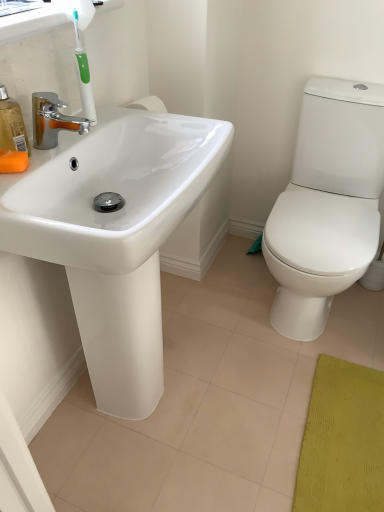
Question: Considering the relative sizes of white matte toilet paper at right and translucent orange soap dispenser at left in the image provided, is white matte toilet paper at right bigger than translucent orange soap dispenser at left?

Choices:
 (A) yes
 (B) no

Answer: (A)

Question: Can you confirm if white matte toilet paper at right is wider than translucent orange soap dispenser at left?

Choices:
 (A) no
 (B) yes

Answer: (B)

Question: Can you confirm if white matte toilet paper at right is thinner than translucent orange soap dispenser at left?

Choices:
 (A) no
 (B) yes

Answer: (A)

Question: Is translucent orange soap dispenser at left inside white matte toilet paper at right?

Choices:
 (A) no
 (B) yes

Answer: (A)

Question: Is white matte toilet paper at right placed right next to translucent orange soap dispenser at left?

Choices:
 (A) yes
 (B) no

Answer: (B)

Question: In the image, is white glossy sink at left on the left side or the right side of white matte toilet paper at right?

Choices:
 (A) right
 (B) left

Answer: (B)

Question: Would you say white glossy sink at left is inside or outside white matte toilet paper at right?

Choices:
 (A) inside
 (B) outside

Answer: (B)

Question: Is white glossy sink at left bigger or smaller than white matte toilet paper at right?

Choices:
 (A) small
 (B) big

Answer: (B)

Question: Considering the positions of white glossy sink at left and white matte toilet paper at right in the image, is white glossy sink at left wider or thinner than white matte toilet paper at right?

Choices:
 (A) wide
 (B) thin

Answer: (A)

Question: Does point (x=84, y=177) appear closer or farther from the camera than point (x=23, y=169)?

Choices:
 (A) farther
 (B) closer

Answer: (A)

Question: From a real-world perspective, is white glossy sink at left positioned above or below orange matte soap at left?

Choices:
 (A) above
 (B) below

Answer: (B)

Question: From the image's perspective, is white glossy sink at left located above or below orange matte soap at left?

Choices:
 (A) below
 (B) above

Answer: (A)

Question: Looking at their shapes, would you say white glossy sink at left is wider or thinner than orange matte soap at left?

Choices:
 (A) thin
 (B) wide

Answer: (B)

Question: Is translucent orange soap dispenser at left in front of or behind white matte toilet paper at right in the image?

Choices:
 (A) front
 (B) behind

Answer: (A)

Question: Based on their positions, is translucent orange soap dispenser at left located to the left or right of white matte toilet paper at right?

Choices:
 (A) right
 (B) left

Answer: (B)